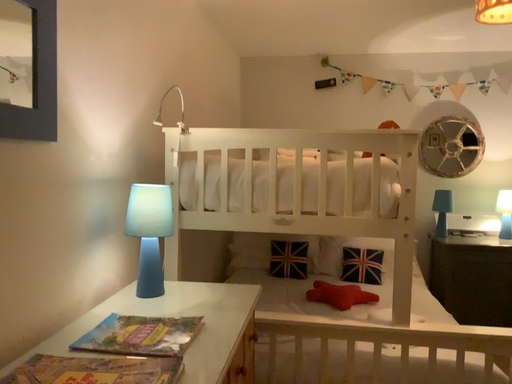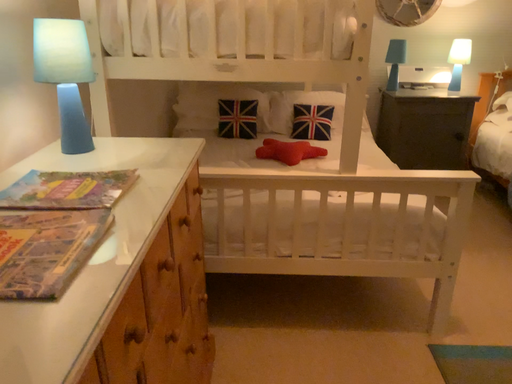
Question: Which way did the camera rotate in the video?

Choices:
 (A) rotated downward
 (B) rotated upward

Answer: (A)